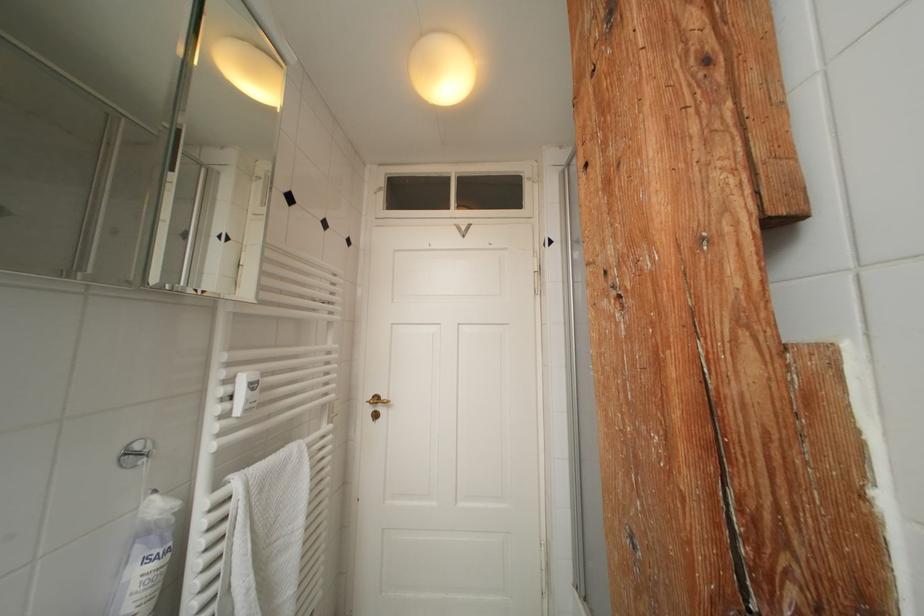
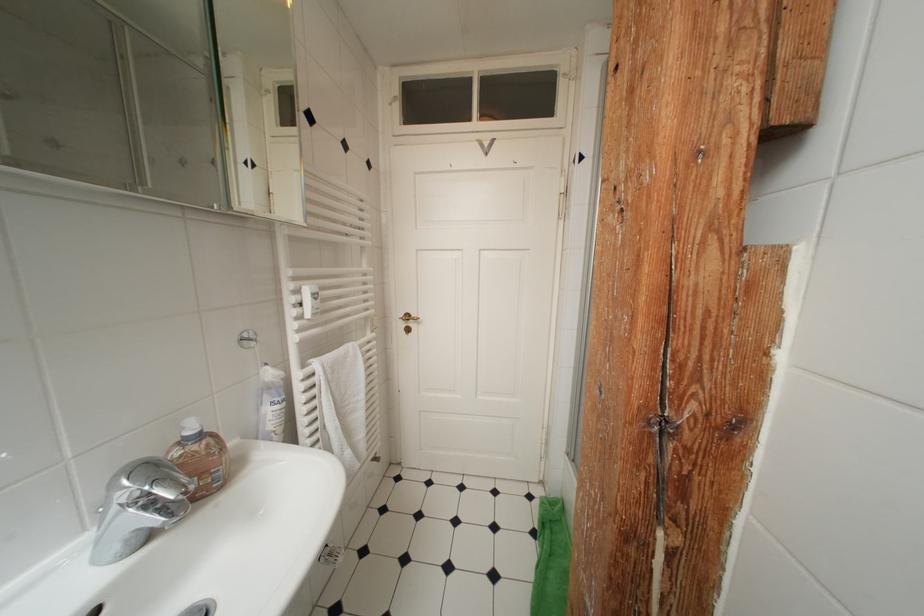
Where in the second image is the point corresponding to point (236, 384) from the first image?

(304, 294)